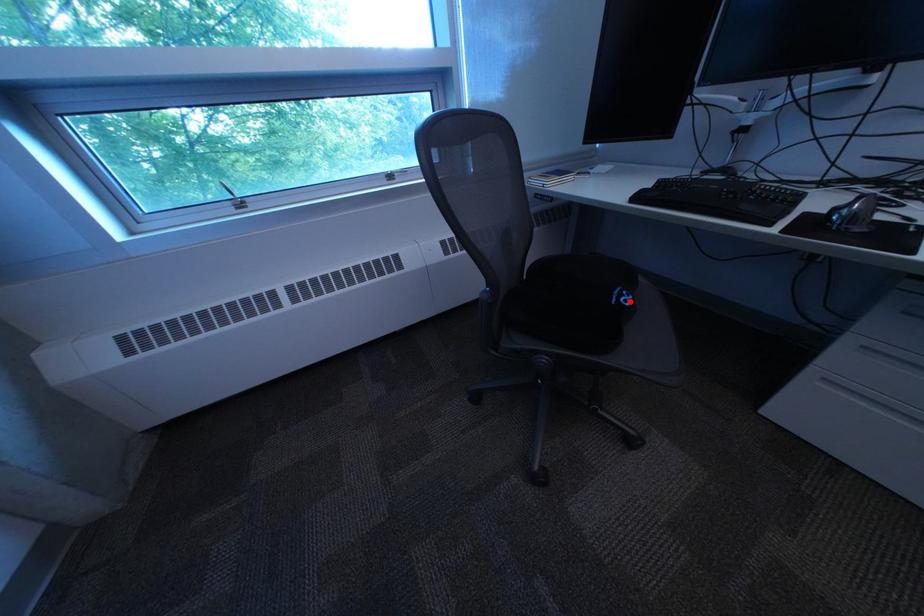
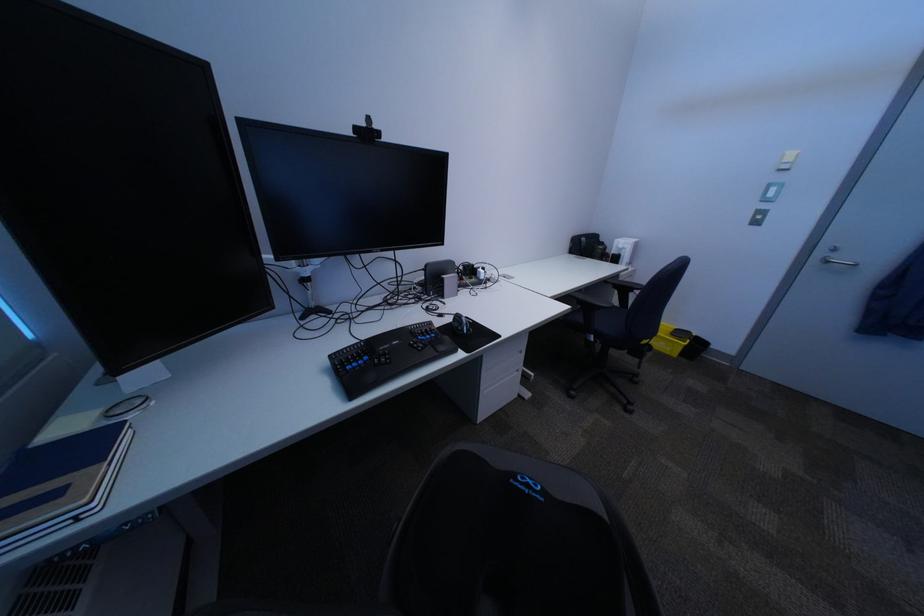
Where in the second image is the point corresponding to the highlighted location from the first image?

(554, 499)